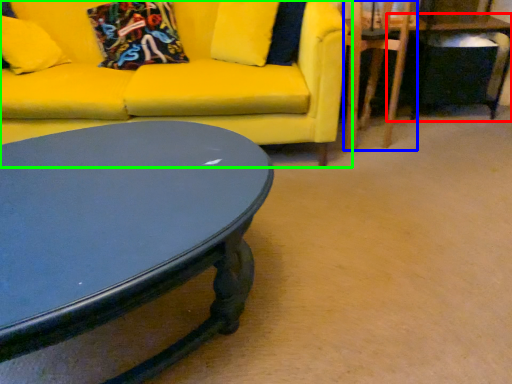
Question: Considering the real-world distances, which object is closest to table (highlighted by a red box)? swivel chair (highlighted by a blue box) or studio couch (highlighted by a green box).

Choices:
 (A) swivel chair
 (B) studio couch

Answer: (A)